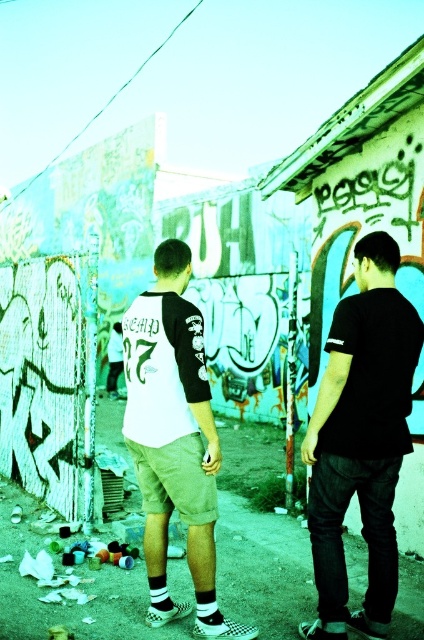
Is black matte shirt at center positioned at the back of white cotton shorts at center?

No, it is not.

Is point (396, 397) positioned after point (195, 328)?

No, (396, 397) is in front of (195, 328).

In order to click on black matte shirt at center in this screenshot , I will do `click(360, 440)`.